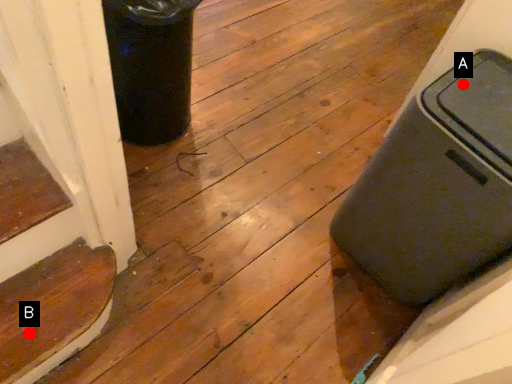
Question: Two points are circled on the image, labeled by A and B beside each circle. Which of the following is the farthest from the observer?

Choices:
 (A) A is further
 (B) B is further

Answer: (A)